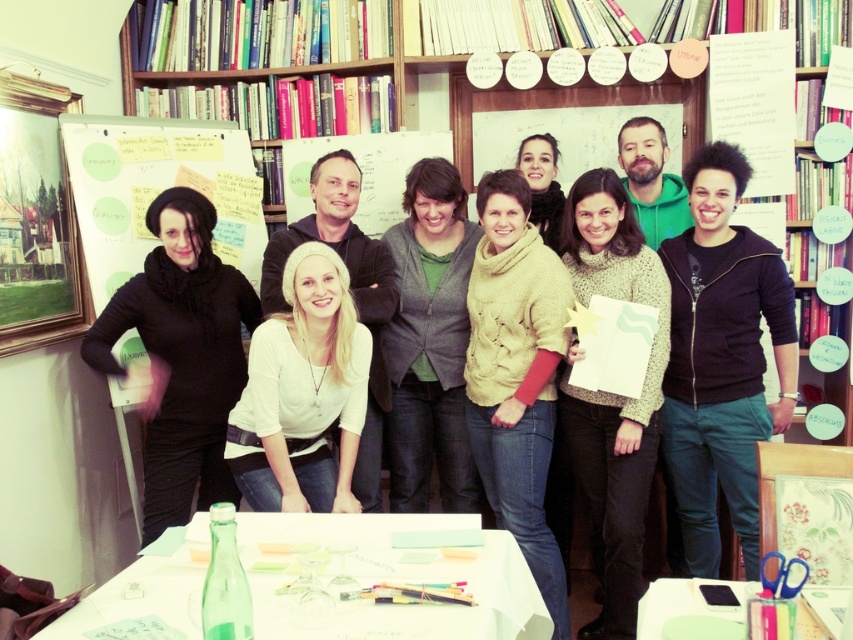
Image resolution: width=853 pixels, height=640 pixels. What are the coordinates of `wooden bookcase at upper center` in the screenshot? It's located at (227, 33).

Does point (277, 12) come closer to viewer compared to point (456, 154)?

Yes.

The image size is (853, 640). What are the coordinates of `wooden bookcase at upper center` in the screenshot? It's located at click(227, 33).

Can you confirm if black matte shirt at left is thinner than green matte table at lower center?

In fact, black matte shirt at left might be wider than green matte table at lower center.

Find the location of a particular element. This screenshot has height=640, width=853. black matte shirt at left is located at coordinates (181, 356).

Locate an element on the screen. black matte shirt at left is located at coordinates 181,356.

Where is `black matte shirt at left`? This screenshot has width=853, height=640. black matte shirt at left is located at coordinates (181, 356).

Can you confirm if white paper table at center is thinner than black matte shirt at left?

No, white paper table at center is not thinner than black matte shirt at left.

Is point (49, 632) positioned after point (207, 468)?

No, it is in front of (207, 468).

The image size is (853, 640). What are the coordinates of `white paper table at center` in the screenshot? It's located at (393, 579).